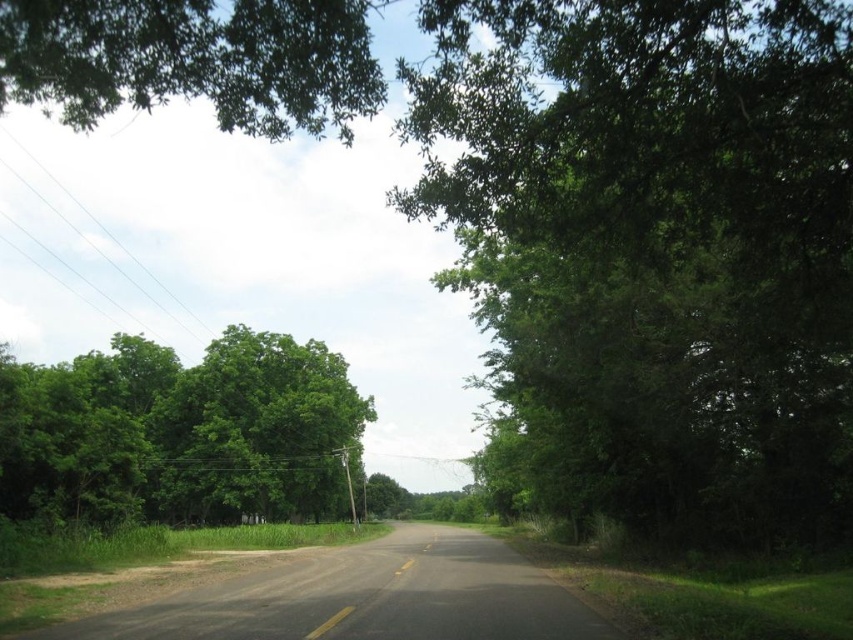
Question: Which object is farther from the camera taking this photo?

Choices:
 (A) green leafy tree at left
 (B) green leafy tree at center

Answer: (A)

Question: Among these points, which one is farthest from the camera?

Choices:
 (A) (238, 371)
 (B) (491, 364)

Answer: (A)

Question: In this image, where is green leafy tree at center located relative to green leafy tree at left?

Choices:
 (A) left
 (B) right

Answer: (B)

Question: Is green leafy tree at center closer to camera compared to green leafy tree at left?

Choices:
 (A) yes
 (B) no

Answer: (A)

Question: Does green leafy tree at center appear on the right side of green leafy tree at left?

Choices:
 (A) no
 (B) yes

Answer: (B)